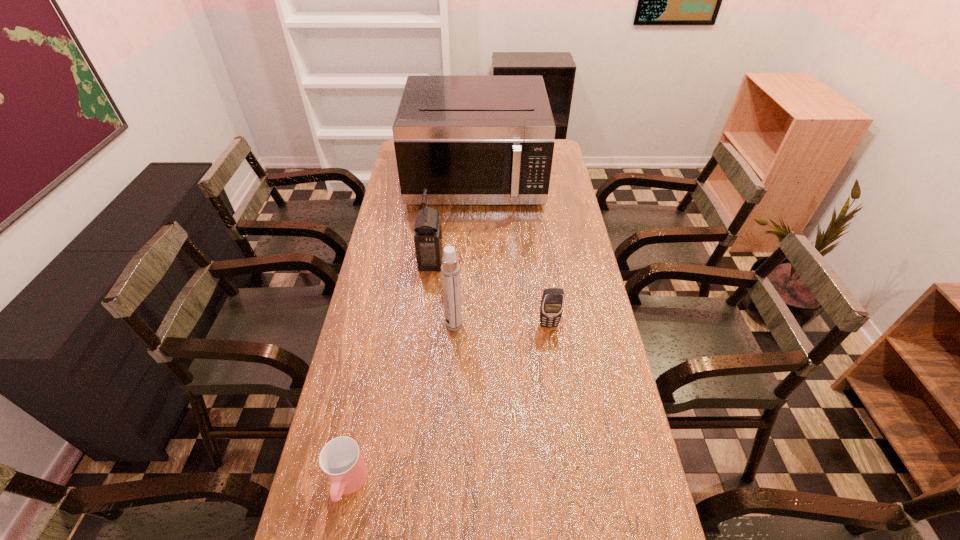
The image size is (960, 540). In order to click on object located in the far edge section of the desktop in this screenshot , I will do `click(469, 140)`.

Where is `microwave_oven that is positioned at the left edge`? This screenshot has height=540, width=960. microwave_oven that is positioned at the left edge is located at coordinates (469, 140).

You are a GUI agent. You are given a task and a screenshot of the screen. Output one action in this format:
    pyautogui.click(x=<x>, y=<y>)
    Task: Click on the lantern at the left edge
    The height and width of the screenshot is (540, 960).
    Given the screenshot: What is the action you would take?
    pyautogui.click(x=428, y=234)

Find the location of a particular element. The height and width of the screenshot is (540, 960). cup situated at the left edge is located at coordinates (341, 460).

Locate an element on the screen. microwave_oven at the right edge is located at coordinates point(469,140).

Locate an element on the screen. The width and height of the screenshot is (960, 540). cellular telephone present at the right edge is located at coordinates (552, 302).

Find the location of a particular element. Image resolution: width=960 pixels, height=540 pixels. object that is at the far left corner is located at coordinates (469, 140).

You are a GUI agent. You are given a task and a screenshot of the screen. Output one action in this format:
    pyautogui.click(x=<x>, y=<y>)
    Task: Click on the object at the far right corner
    This screenshot has width=960, height=540.
    Given the screenshot: What is the action you would take?
    pyautogui.click(x=469, y=140)

Image resolution: width=960 pixels, height=540 pixels. What are the coordinates of `blank area at the left edge` in the screenshot? It's located at (359, 413).

The image size is (960, 540). In the image, there is a desktop. What are the coordinates of `free space at the right edge` in the screenshot? It's located at (565, 356).